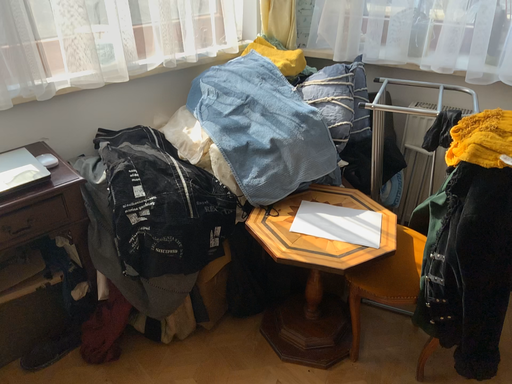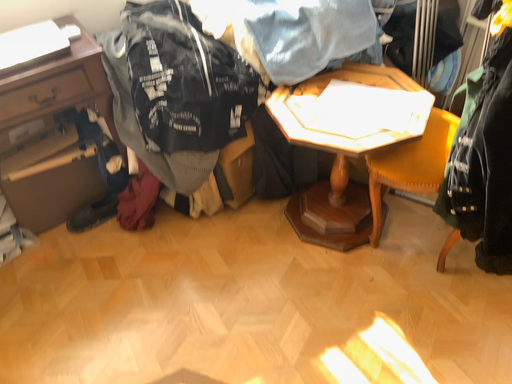
Question: Which way did the camera rotate in the video?

Choices:
 (A) rotated upward
 (B) rotated downward

Answer: (B)